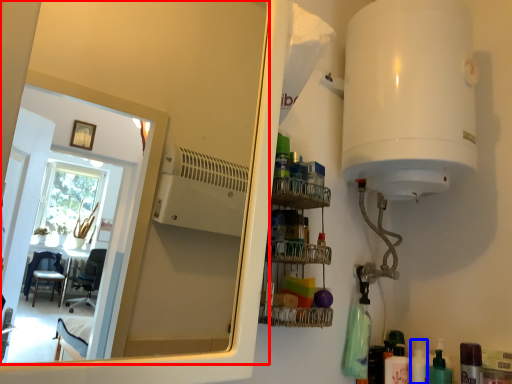
Question: Among these objects, which one is farthest to the camera, mirror (highlighted by a red box) or toiletry (highlighted by a blue box)?

Choices:
 (A) mirror
 (B) toiletry

Answer: (B)